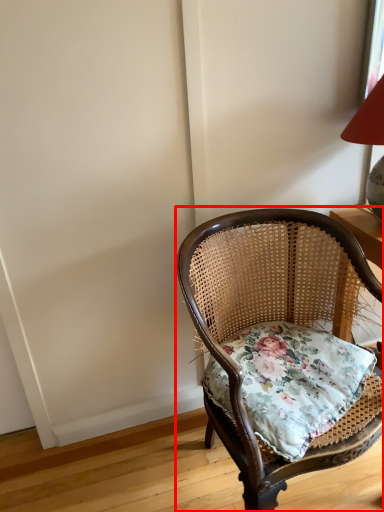
Question: From the image's perspective, considering the relative positions of chair (annotated by the red box) and pillow in the image provided, where is chair (annotated by the red box) located with respect to the staircase?

Choices:
 (A) below
 (B) above

Answer: (A)